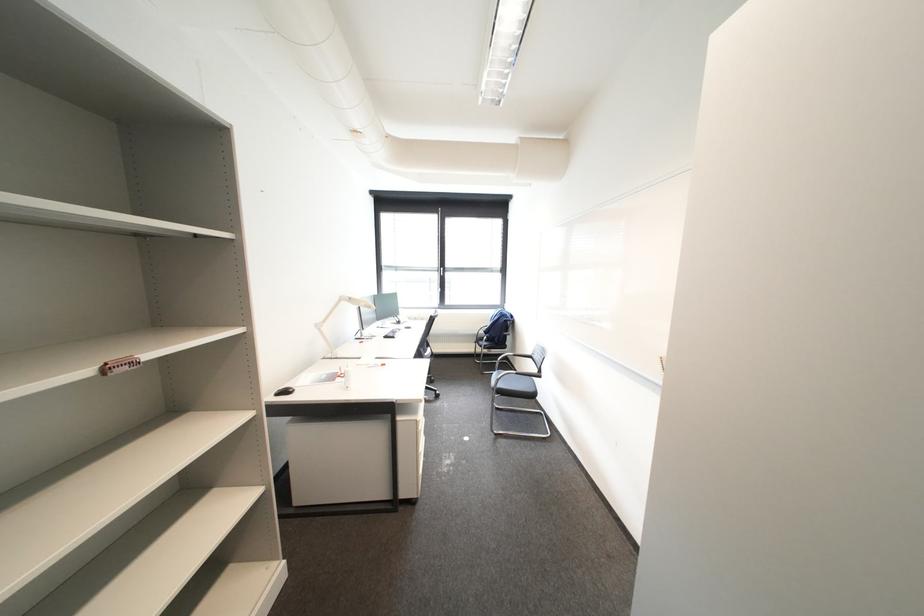
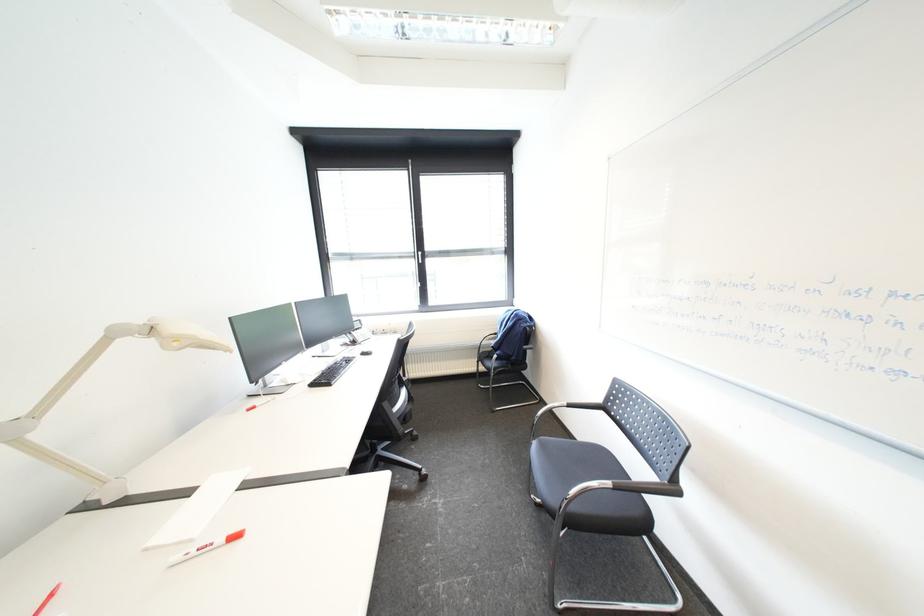
Question: What movement of the cameraman would produce the second image?

Choices:
 (A) Left
 (B) Right
 (C) Forward
 (D) Backward

Answer: (C)